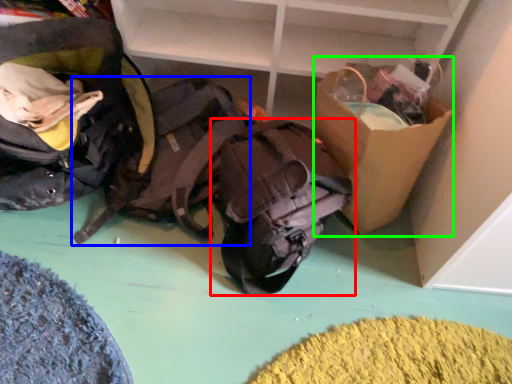
Question: Which object is positioned farthest from backpack (highlighted by a red box)? Select from backpack (highlighted by a blue box) and cardboard box (highlighted by a green box).

Choices:
 (A) backpack
 (B) cardboard box

Answer: (A)